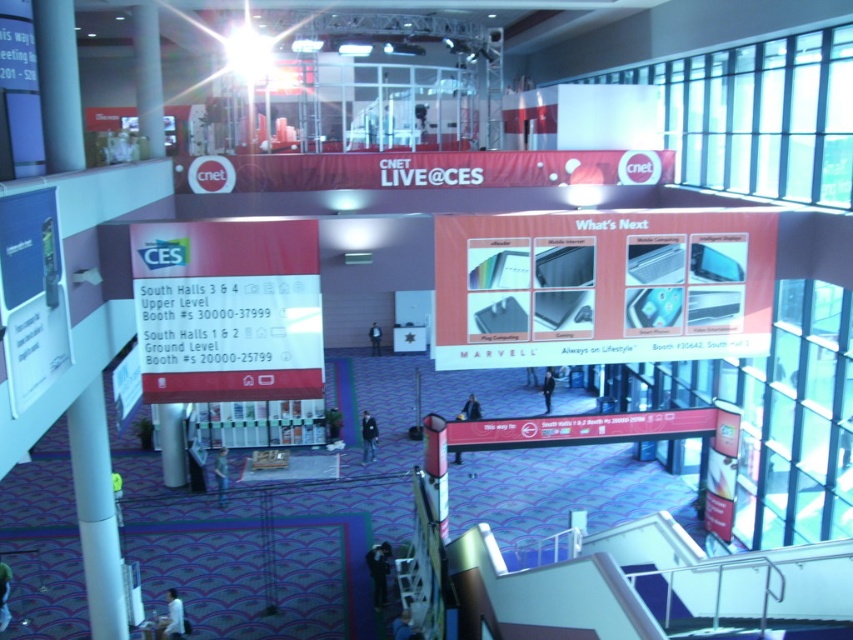
You are at the CNET LIVE event and need to locate the dark blue jacket at center. According to the coordinates provided, where exactly is the dark blue jacket positioned in the image?

The dark blue jacket at center is positioned at coordinates point (368, 436).

You are organizing a guided tour for attendees at the CNET LIVE event. You need to ensure that participants can hear the speaker clearly from the front. The speaker is standing at the dark blue jacket at center. What is the minimum distance you should maintain between the speaker and the nearest attendee, who is the green fabric person at lower left, to ensure clear audio transmission?

The minimum distance between the speaker at the dark blue jacket at center and the green fabric person at lower left should be at least 7.52 meters to ensure clear audio transmission.